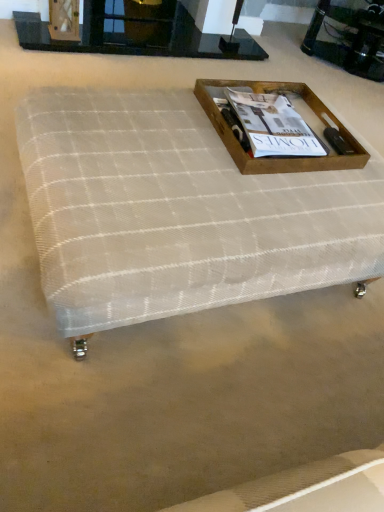
Question: Is wooden tray at center at the back of shiny black glass tray at upper right?

Choices:
 (A) no
 (B) yes

Answer: (A)

Question: Can you confirm if shiny black glass tray at upper right is thinner than wooden tray at center?

Choices:
 (A) yes
 (B) no

Answer: (A)

Question: Is shiny black glass tray at upper right aimed at wooden tray at center?

Choices:
 (A) no
 (B) yes

Answer: (B)

Question: Does shiny black glass tray at upper right come behind wooden tray at center?

Choices:
 (A) no
 (B) yes

Answer: (B)

Question: From the image's perspective, would you say shiny black glass tray at upper right is positioned over wooden tray at center?

Choices:
 (A) yes
 (B) no

Answer: (A)

Question: Can you confirm if shiny black glass tray at upper right is positioned to the right of wooden tray at center?

Choices:
 (A) no
 (B) yes

Answer: (B)

Question: From the image's perspective, does white mesh ottoman at center appear lower than black glass fireplace at upper center?

Choices:
 (A) yes
 (B) no

Answer: (A)

Question: Considering the relative positions of white mesh ottoman at center and black glass fireplace at upper center in the image provided, is white mesh ottoman at center to the right of black glass fireplace at upper center from the viewer's perspective?

Choices:
 (A) yes
 (B) no

Answer: (A)

Question: Is black glass fireplace at upper center located within white mesh ottoman at center?

Choices:
 (A) yes
 (B) no

Answer: (B)

Question: Is white mesh ottoman at center facing away from black glass fireplace at upper center?

Choices:
 (A) no
 (B) yes

Answer: (A)

Question: Are white mesh ottoman at center and black glass fireplace at upper center making contact?

Choices:
 (A) yes
 (B) no

Answer: (B)

Question: Is white mesh ottoman at center facing towards black glass fireplace at upper center?

Choices:
 (A) no
 (B) yes

Answer: (B)

Question: Is white mesh ottoman at center positioned beyond the bounds of matte brown wooden tray at upper center?

Choices:
 (A) no
 (B) yes

Answer: (B)